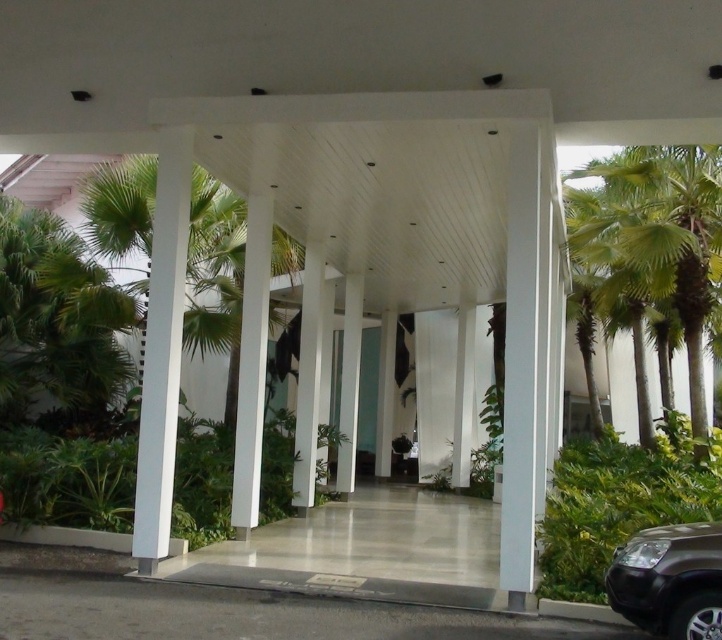
Is point (513, 314) positioned before point (630, 540)?

No, it is behind (630, 540).

Which is more to the left, white glossy pillar at right or satin brown suv at lower right?

white glossy pillar at right is more to the left.

Image resolution: width=722 pixels, height=640 pixels. What are the coordinates of `white glossy pillar at right` in the screenshot? It's located at (521, 364).

The height and width of the screenshot is (640, 722). Identify the location of green leafy palm tree at right. (656, 241).

Is green leafy palm tree at right to the right of white glossy pillar at right from the viewer's perspective?

Indeed, green leafy palm tree at right is positioned on the right side of white glossy pillar at right.

Where is `green leafy palm tree at right`? This screenshot has height=640, width=722. green leafy palm tree at right is located at coordinates (656, 241).

Where is `green leafy palm tree at right`? green leafy palm tree at right is located at coordinates (656, 241).